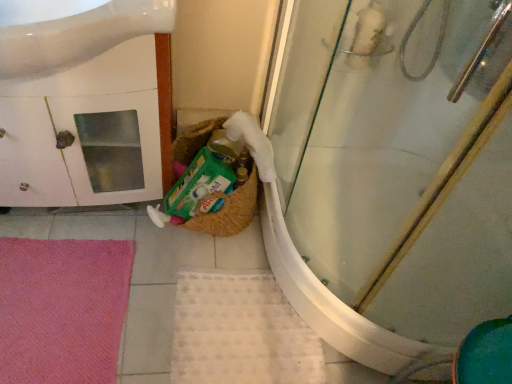
Question: Considering the relative sizes of pink soft bath mat at lower left, which is the 1th bath mat in left-to-right order, and white glossy cabinet at left in the image provided, is pink soft bath mat at lower left, which is the 1th bath mat in left-to-right order, bigger than white glossy cabinet at left?

Choices:
 (A) no
 (B) yes

Answer: (A)

Question: Is pink soft bath mat at lower left, which appears as the second bath mat when viewed from the right, behind white glossy cabinet at left?

Choices:
 (A) yes
 (B) no

Answer: (A)

Question: Could you tell me if pink soft bath mat at lower left, which is the 1th bath mat in left-to-right order, is turned towards white glossy cabinet at left?

Choices:
 (A) yes
 (B) no

Answer: (B)

Question: Is pink soft bath mat at lower left, which is the 1th bath mat in left-to-right order, shorter than white glossy cabinet at left?

Choices:
 (A) yes
 (B) no

Answer: (A)

Question: Considering the relative positions of pink soft bath mat at lower left, which is the 1th bath mat in left-to-right order, and white glossy cabinet at left in the image provided, is pink soft bath mat at lower left, which is the 1th bath mat in left-to-right order, to the right of white glossy cabinet at left from the viewer's perspective?

Choices:
 (A) no
 (B) yes

Answer: (A)

Question: Can you confirm if pink soft bath mat at lower left, which is the 1th bath mat in left-to-right order, is thinner than white glossy cabinet at left?

Choices:
 (A) no
 (B) yes

Answer: (A)

Question: Does transparent glass shower door at center have a smaller size compared to pink soft bath mat at lower left, which is the 1th bath mat in left-to-right order?

Choices:
 (A) yes
 (B) no

Answer: (B)

Question: Is the position of transparent glass shower door at center more distant than that of pink soft bath mat at lower left, which is the 1th bath mat in left-to-right order?

Choices:
 (A) yes
 (B) no

Answer: (B)

Question: Is transparent glass shower door at center turned away from pink soft bath mat at lower left, which appears as the second bath mat when viewed from the right?

Choices:
 (A) yes
 (B) no

Answer: (B)

Question: Is transparent glass shower door at center bigger than pink soft bath mat at lower left, which is the 1th bath mat in left-to-right order?

Choices:
 (A) yes
 (B) no

Answer: (A)

Question: Is transparent glass shower door at center shorter than pink soft bath mat at lower left, which is the 1th bath mat in left-to-right order?

Choices:
 (A) yes
 (B) no

Answer: (B)

Question: Are transparent glass shower door at center and pink soft bath mat at lower left, which appears as the second bath mat when viewed from the right, making contact?

Choices:
 (A) yes
 (B) no

Answer: (B)

Question: Is transparent glass shower door at center surrounded by white glossy sink at upper left?

Choices:
 (A) no
 (B) yes

Answer: (A)